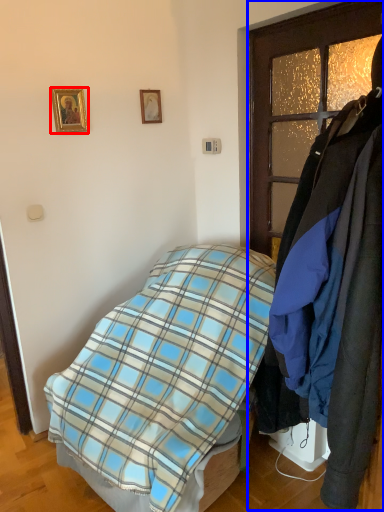
Question: Which point is further to the camera, picture frame (highlighted by a red box) or closet (highlighted by a blue box)?

Choices:
 (A) picture frame
 (B) closet

Answer: (A)